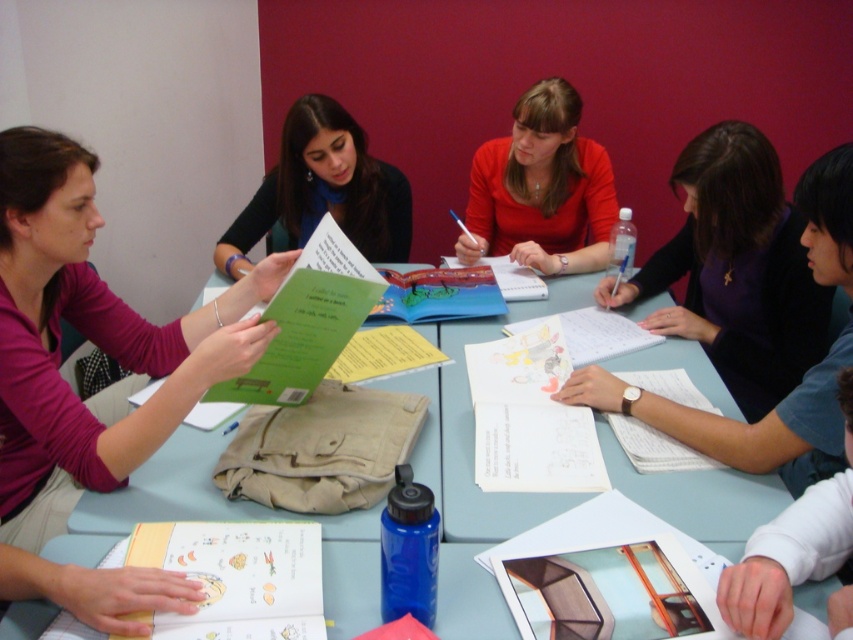
Is point (193, 566) positioned after point (248, 384)?

No, it is not.

Does paper with illustrations at center appear on the right side of green paper at center?

No, paper with illustrations at center is not to the right of green paper at center.

Is point (233, 593) behind point (294, 285)?

No, it is not.

Image resolution: width=853 pixels, height=640 pixels. What are the coordinates of `paper with illustrations at center` in the screenshot? It's located at (236, 577).

Is matte green book at center in front of blue plastic bottle at lower center?

No, it is not.

Does matte green book at center have a lesser height compared to blue plastic bottle at lower center?

In fact, matte green book at center may be taller than blue plastic bottle at lower center.

Is point (300, 221) more distant than point (335, 570)?

Yes, it is.

Image resolution: width=853 pixels, height=640 pixels. Identify the location of matte green book at center. (323, 189).

Is the position of matte green book at center less distant than that of white paper at lower right?

No, matte green book at center is further to the viewer.

At what (x,y) coordinates should I click in order to perform the action: click on matte green book at center. Please return your answer as a coordinate pair (x, y). This screenshot has width=853, height=640. Looking at the image, I should click on (323, 189).

The width and height of the screenshot is (853, 640). What do you see at coordinates (323, 189) in the screenshot? I see `matte green book at center` at bounding box center [323, 189].

Where is `matte green book at center`? This screenshot has width=853, height=640. matte green book at center is located at coordinates (323, 189).